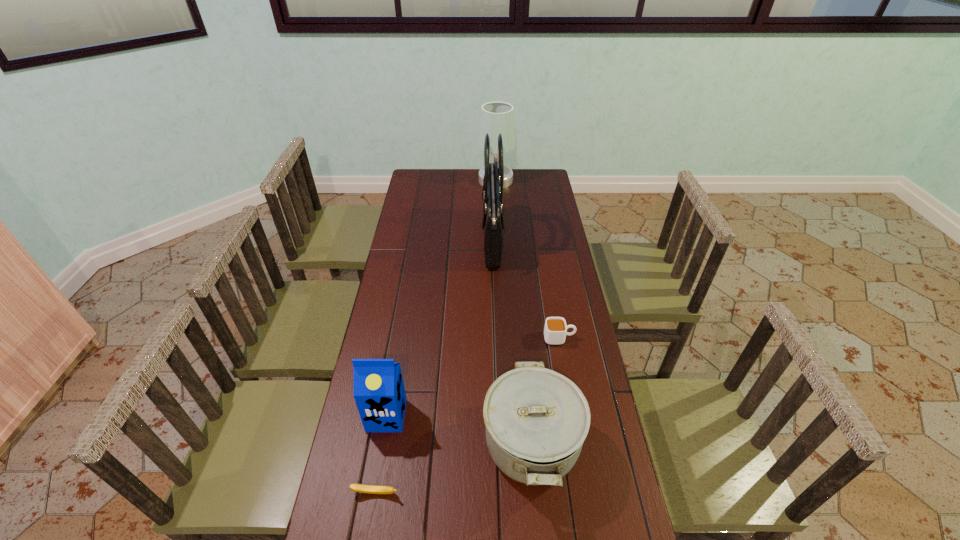
You are a GUI agent. You are given a task and a screenshot of the screen. Output one action in this format:
    pyautogui.click(x=<x>, y=<y>)
    Task: Click on the saucepan present at the right edge
    
    Given the screenshot: What is the action you would take?
    pyautogui.click(x=536, y=419)

The image size is (960, 540). What are the coordinates of `cup present at the right edge` in the screenshot? It's located at (555, 330).

Locate an element on the screen. free space at the far edge of the desktop is located at coordinates (507, 189).

Find the location of `blank space at the left edge of the desktop`. blank space at the left edge of the desktop is located at coordinates (368, 353).

I want to click on vacant position at the right edge of the desktop, so click(x=599, y=381).

What are the coordinates of `blank space at the far left corner of the desktop` in the screenshot? It's located at (438, 186).

Identify the location of free point between the shortest object and the fifth nearest object. (434, 366).

This screenshot has width=960, height=540. I want to click on vacant space in between the farthest object and the fifth tallest object, so click(527, 259).

Identify the location of free space between the second tallest object and the fourth nearest object. Image resolution: width=960 pixels, height=540 pixels. (527, 259).

Where is `free spot between the banana and the fourth shortest object`? This screenshot has width=960, height=540. free spot between the banana and the fourth shortest object is located at coordinates (381, 454).